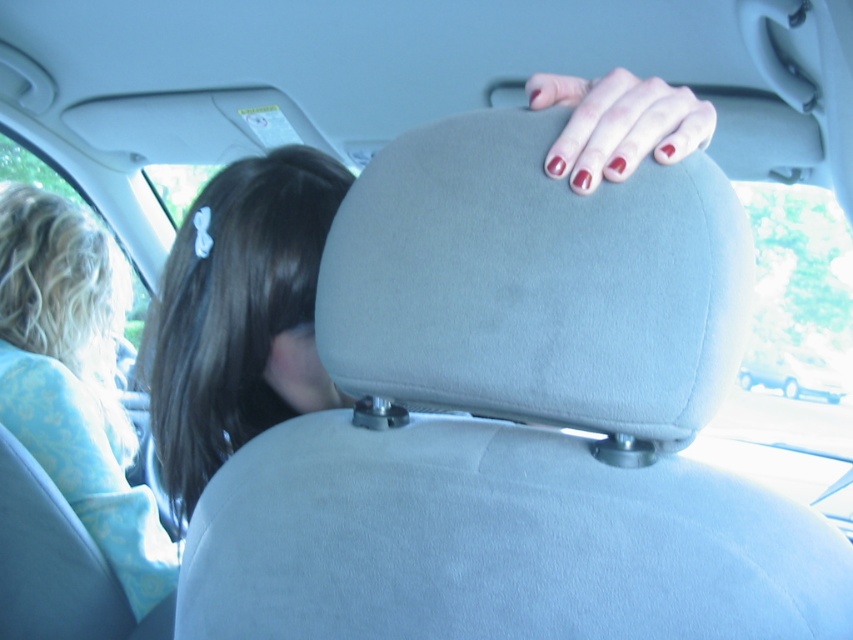
From the picture: Who is higher up, dark brown hair at upper left or blonde hair at left?

dark brown hair at upper left

Can you confirm if dark brown hair at upper left is shorter than blonde hair at left?

Correct, dark brown hair at upper left is not as tall as blonde hair at left.

Who is more forward, [183,266] or [3,412]?

Point [183,266]

Locate an element on the screen. The width and height of the screenshot is (853, 640). dark brown hair at upper left is located at coordinates (239, 314).

Looking at this image, is blonde hair at left wider than white matte van at upper center?

No.

Which is more to the left, blonde hair at left or white matte van at upper center?

blonde hair at left

This screenshot has width=853, height=640. What are the coordinates of `blonde hair at left` in the screenshot? It's located at (74, 380).

Where is `blonde hair at left`? blonde hair at left is located at coordinates (74, 380).

Which of these two, blonde hair at left or matte red nails at upper center, stands shorter?

matte red nails at upper center

Find the location of a particular element. Image resolution: width=853 pixels, height=640 pixels. blonde hair at left is located at coordinates (74, 380).

You are a GUI agent. You are given a task and a screenshot of the screen. Output one action in this format:
    pyautogui.click(x=<x>, y=<y>)
    Task: Click on the blonde hair at left
    The image size is (853, 640).
    Given the screenshot: What is the action you would take?
    pyautogui.click(x=74, y=380)